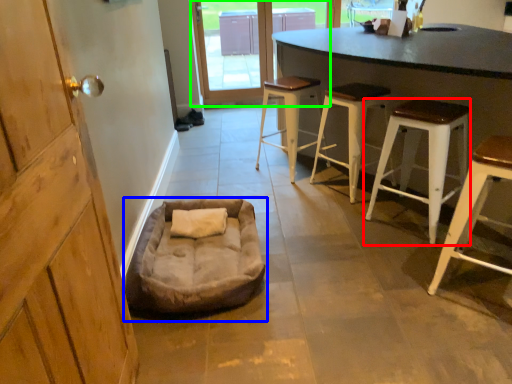
Question: Based on their relative distances, which object is farther from stool (highlighted by a red box)? Choose from dog bed (highlighted by a blue box) and glass door (highlighted by a green box).

Choices:
 (A) dog bed
 (B) glass door

Answer: (B)